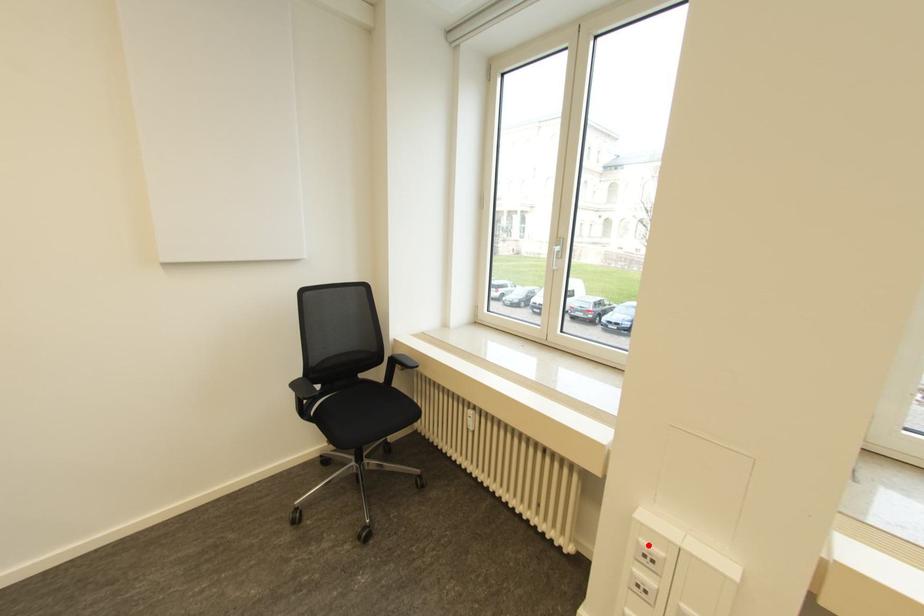
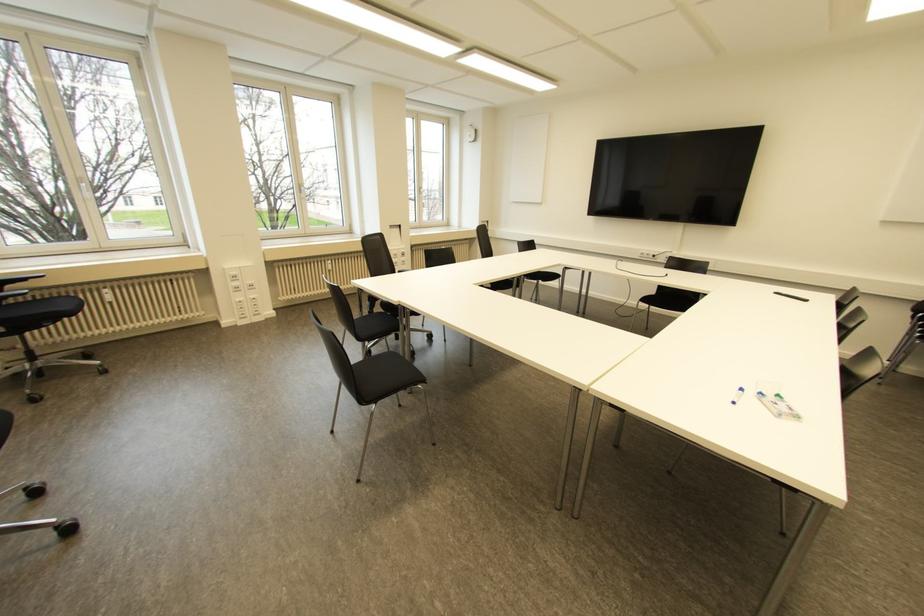
Find the pixel in the second image that matches the highlighted location in the first image.

(232, 273)